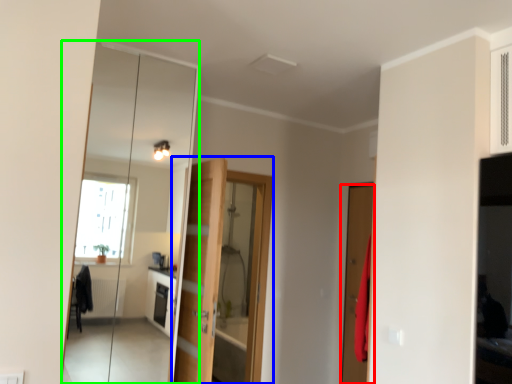
Question: Based on their relative distances, which object is nearer to door (highlighted by a red box)? Choose from door (highlighted by a blue box) and mirror (highlighted by a green box).

Choices:
 (A) door
 (B) mirror

Answer: (A)